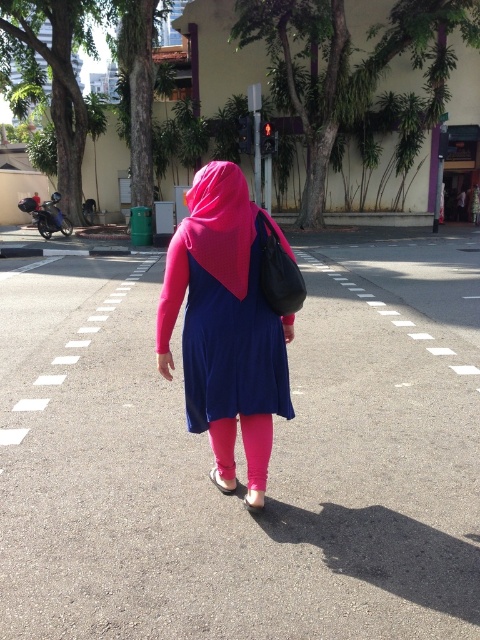
Can you confirm if pink fabric pants at center is positioned below matte pink sandal at center?

No.

Is pink fabric pants at center thinner than matte pink sandal at center?

In fact, pink fabric pants at center might be wider than matte pink sandal at center.

Is point (217, 458) closer to camera compared to point (216, 481)?

That is True.

Where is `pink fabric pants at center`? Image resolution: width=480 pixels, height=640 pixels. pink fabric pants at center is located at coordinates (256, 448).

Can you confirm if matte pink dress at center is positioned to the left of matte pink sandal at center?

Indeed, matte pink dress at center is positioned on the left side of matte pink sandal at center.

Is the position of matte pink dress at center less distant than that of matte pink sandal at center?

Yes.

I want to click on matte pink dress at center, so click(226, 323).

Which is more to the left, pink fabric pants at center or pink fabric sandal at lower center?

pink fabric pants at center is more to the left.

Does pink fabric pants at center have a greater width compared to pink fabric sandal at lower center?

Yes, pink fabric pants at center is wider than pink fabric sandal at lower center.

Between point (250, 490) and point (252, 509), which one is positioned behind?

Positioned behind is point (250, 490).

Identify the location of pink fabric pants at center. (256, 448).